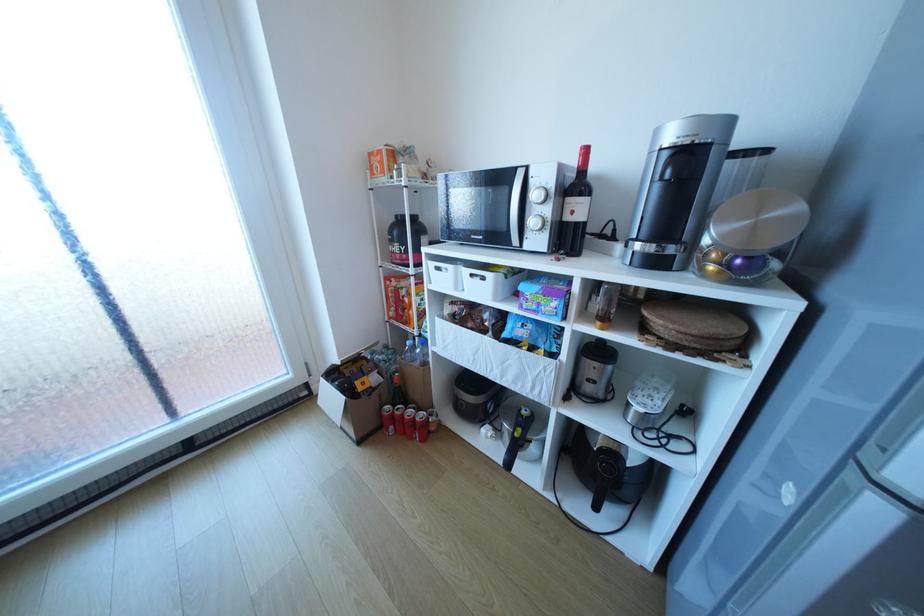
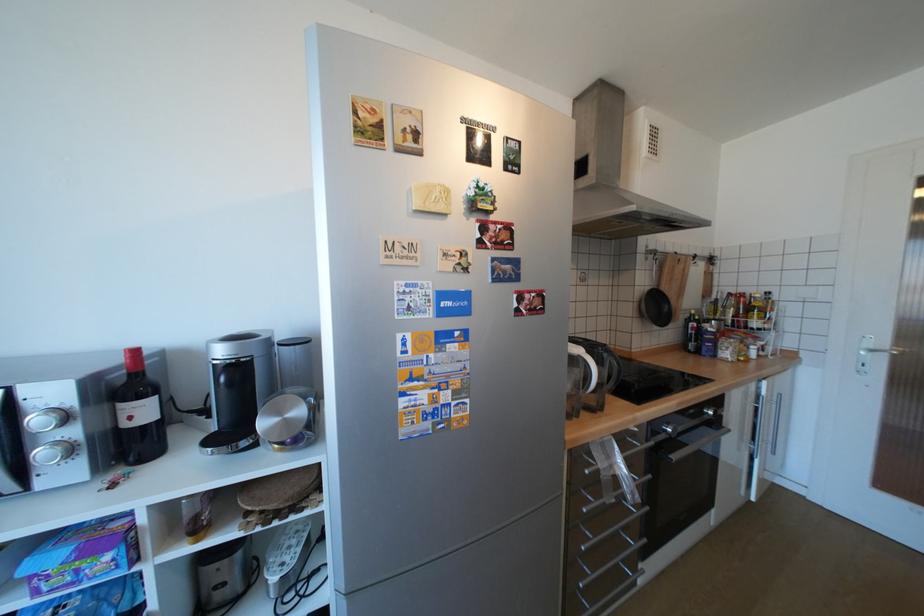
Question: The images are taken continuously from a first-person perspective. In which direction is your viewpoint rotating?

Choices:
 (A) Left
 (B) Right
 (C) Up
 (D) Down

Answer: (B)